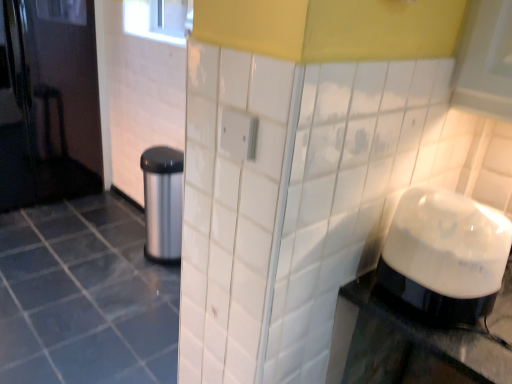
Question: Is white glossy blender at right oriented away from satin silver trash can at left?

Choices:
 (A) yes
 (B) no

Answer: (B)

Question: Is white glossy blender at right aimed at satin silver trash can at left?

Choices:
 (A) no
 (B) yes

Answer: (A)

Question: Can we say white glossy blender at right lies outside satin silver trash can at left?

Choices:
 (A) yes
 (B) no

Answer: (A)

Question: Does white glossy blender at right have a greater width compared to satin silver trash can at left?

Choices:
 (A) no
 (B) yes

Answer: (A)

Question: Is white glossy blender at right far away from satin silver trash can at left?

Choices:
 (A) no
 (B) yes

Answer: (B)

Question: Can you confirm if white glossy blender at right is taller than satin silver trash can at left?

Choices:
 (A) no
 (B) yes

Answer: (A)

Question: Is white glossy blender at right located within white glossy tile at center?

Choices:
 (A) yes
 (B) no

Answer: (B)

Question: From a real-world perspective, is white glossy tile at center located higher than white glossy blender at right?

Choices:
 (A) yes
 (B) no

Answer: (B)

Question: Considering the relative sizes of white glossy tile at center and white glossy blender at right in the image provided, is white glossy tile at center smaller than white glossy blender at right?

Choices:
 (A) no
 (B) yes

Answer: (A)

Question: Is white glossy tile at center at the right side of white glossy blender at right?

Choices:
 (A) yes
 (B) no

Answer: (B)

Question: From the image's perspective, is white glossy tile at center on top of white glossy blender at right?

Choices:
 (A) no
 (B) yes

Answer: (A)

Question: From a real-world perspective, is white glossy tile at center beneath white glossy blender at right?

Choices:
 (A) yes
 (B) no

Answer: (A)

Question: Is satin silver trash can at left to the left of white glossy blender at right from the viewer's perspective?

Choices:
 (A) yes
 (B) no

Answer: (A)